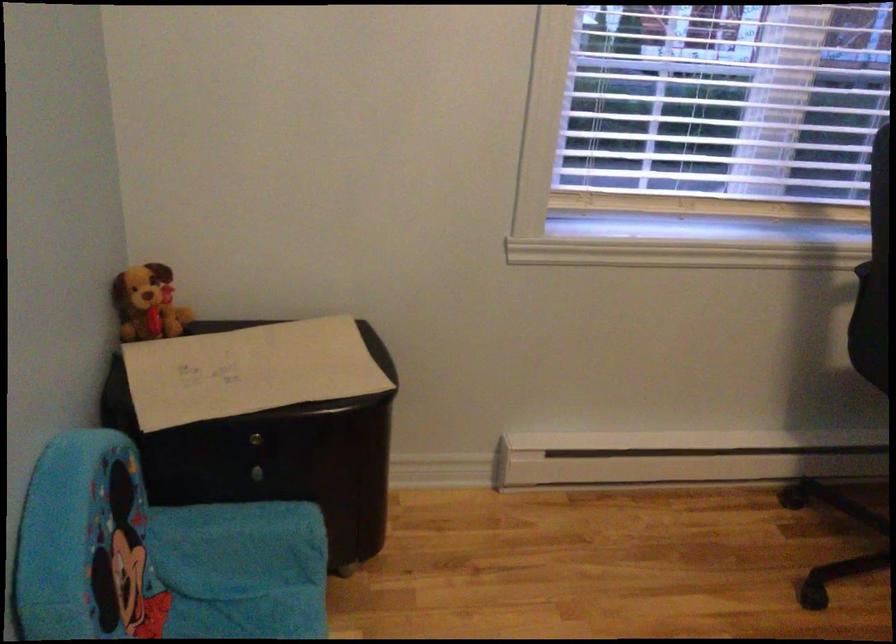
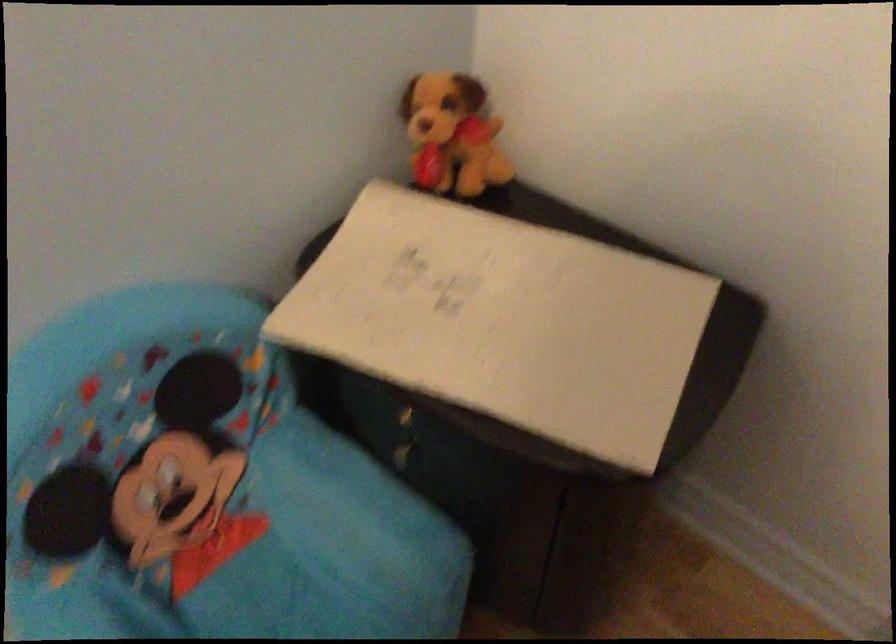
Where in the second image is the point corresponding to (168,292) from the first image?

(452, 134)